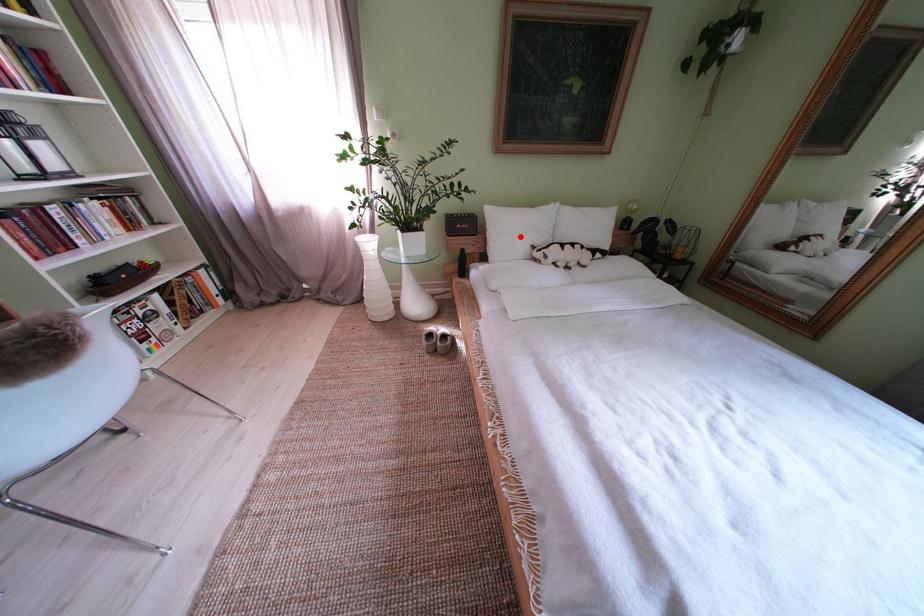
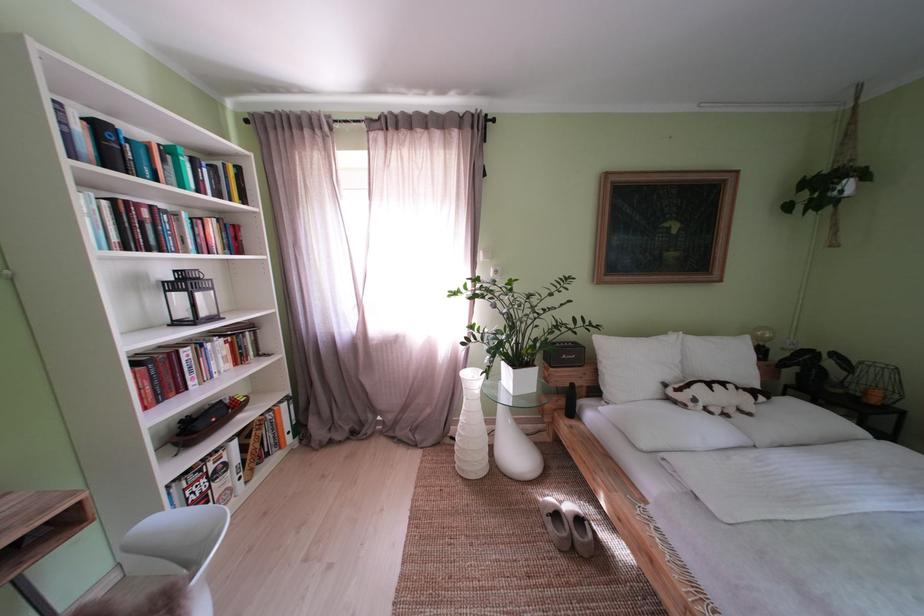
Question: I am providing you with two images of the same scene from different viewpoints. A red point is shown in image1. For the corresponding object point in image2, is it positioned nearer or farther from the camera?

Choices:
 (A) Nearer
 (B) Farther

Answer: (B)